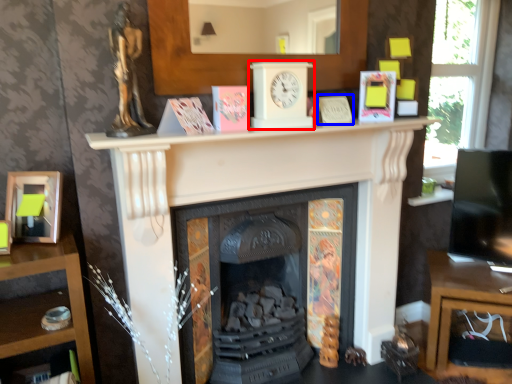
Question: Which object appears farthest to the camera in this image, clock (highlighted by a red box) or paperback book (highlighted by a blue box)?

Choices:
 (A) clock
 (B) paperback book

Answer: (B)